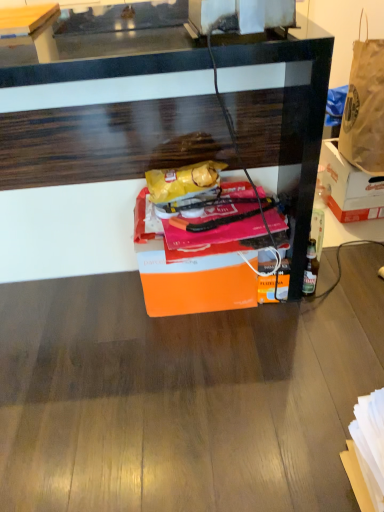
Question: From their relative heights in the image, would you say orange matte box at center, which is the 2th box in right-to-left order, is taller or shorter than orange cardboard box at right, the second box positioned from the left?

Choices:
 (A) tall
 (B) short

Answer: (A)

Question: Is orange matte box at center, the 1th box positioned from the left, wider or thinner than orange cardboard box at right, acting as the first box starting from the back?

Choices:
 (A) thin
 (B) wide

Answer: (A)

Question: Estimate the real-world distances between objects in this image. Which object is farther from the wooden desk at center?

Choices:
 (A) orange matte box at center, which ranks as the second box in back-to-front order
 (B) brown paper bag at upper right
 (C) wooden table at upper left
 (D) orange cardboard box at right, acting as the first box starting from the back

Answer: (C)

Question: Based on their relative distances, which object is farther from the orange matte box at center, the 1th box positioned from the left?

Choices:
 (A) brown paper bag at upper right
 (B) orange cardboard box at right, positioned as the first box in right-to-left order
 (C) wooden desk at center
 (D) wooden table at upper left

Answer: (D)